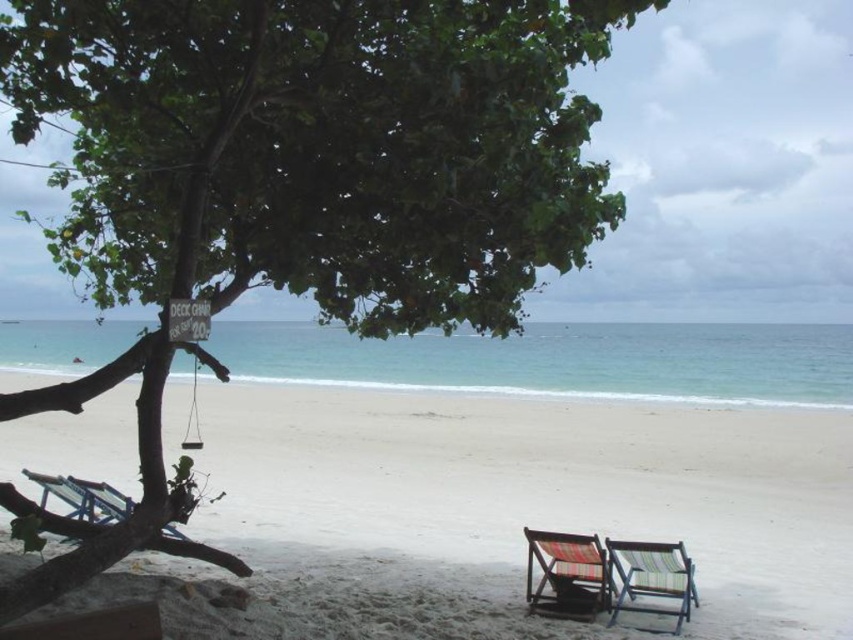
From the picture: You are a beachgoer who wants to sit comfortably between the plaid fabric beach chair at lower right and the striped fabric beach chair at lower right. Given that your body requires 40 centimeters of space to sit comfortably, can you fit between them?

The plaid fabric beach chair at lower right and the striped fabric beach chair at lower right are 36.01 centimeters apart from each other. Since your required space is 40 centimeters, you cannot comfortably fit between them.

You are standing at the coordinates 0.5, 0.5 in the image. You want to walk to the white sandy beach at center. Which direction should you move?

The white sandy beach at center is located at point (538, 490). Since you are at (426, 320), you should move northeast to reach it.